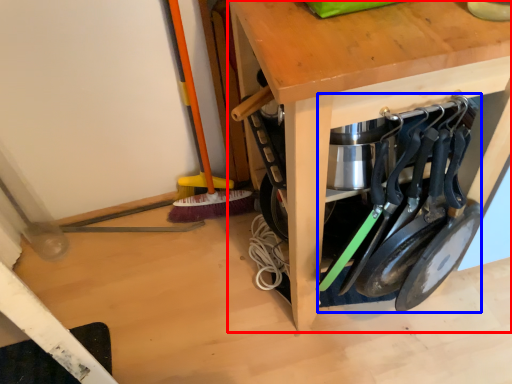
Question: Which of the following is the farthest to the observer, table (highlighted by a red box) or tool (highlighted by a blue box)?

Choices:
 (A) table
 (B) tool

Answer: (B)